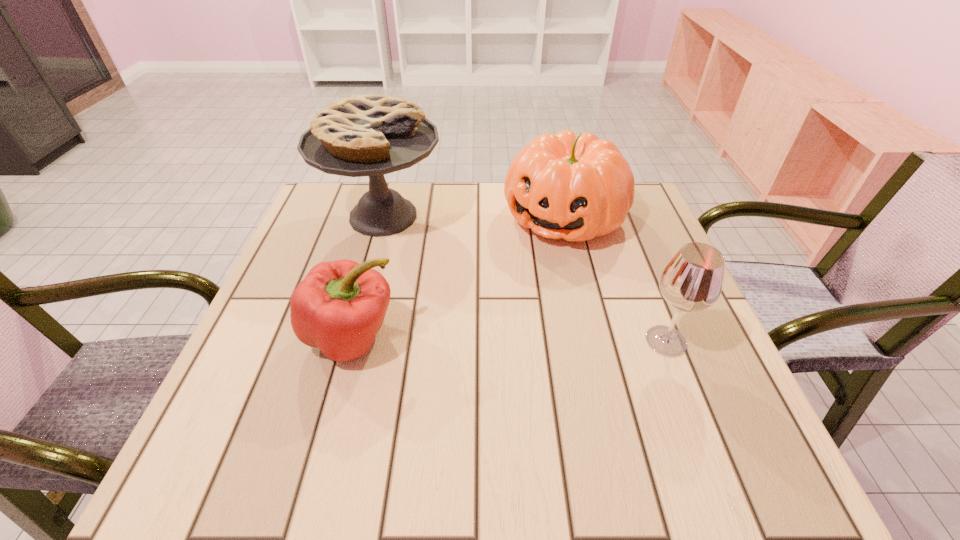
Locate an element on the screen. vacant space located 0.340m on the cut side of the tallest object is located at coordinates (522, 323).

Find the location of `vacant space located on the cut side of the tallest object`. vacant space located on the cut side of the tallest object is located at coordinates (472, 285).

This screenshot has height=540, width=960. I want to click on pumpkin located in the far edge section of the desktop, so click(x=576, y=187).

Identify the location of pie at the far edge. This screenshot has height=540, width=960. (371, 135).

Where is `bell pepper positioned at the left edge`? This screenshot has height=540, width=960. bell pepper positioned at the left edge is located at coordinates (339, 307).

Where is `pie at the left edge`? Image resolution: width=960 pixels, height=540 pixels. pie at the left edge is located at coordinates (371, 135).

Where is `wineglass that is at the right edge`? This screenshot has width=960, height=540. wineglass that is at the right edge is located at coordinates (692, 281).

Where is `pumpkin present at the right edge`? Image resolution: width=960 pixels, height=540 pixels. pumpkin present at the right edge is located at coordinates (x=576, y=187).

The height and width of the screenshot is (540, 960). I want to click on object that is at the far left corner, so pos(371,135).

Locate an element on the screen. This screenshot has height=540, width=960. object that is positioned at the far right corner is located at coordinates (576, 187).